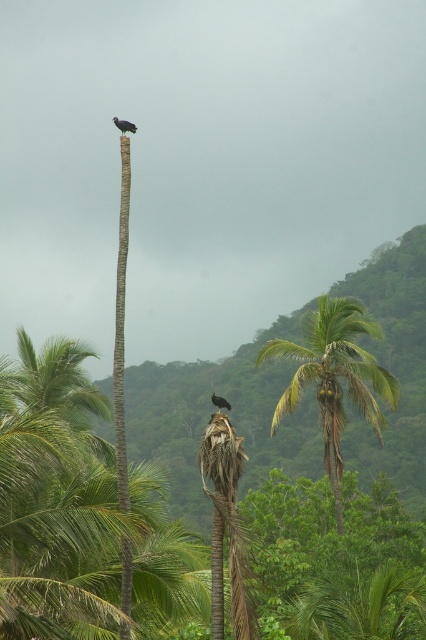
You are standing in the tropical scene and want to locate the point at coordinates (55, 497). Which object in the scene is this point located on?

The point at coordinates (55, 497) is located on the green leafy coconut tree at center.

You are standing in the tropical scene and want to climb the tallest tree to get a better view. Which tree should you choose between the green leafy coconut tree at center and the green leafy palm tree at center?

The green leafy palm tree at center is taller than the green leafy coconut tree at center, so you should choose the green leafy palm tree at center to climb for a better view.

You are standing at the origin point in the tropical scene. Where is the green leafy coconut tree at center located in terms of coordinates?

The green leafy coconut tree at center is located at coordinates point (55, 497).